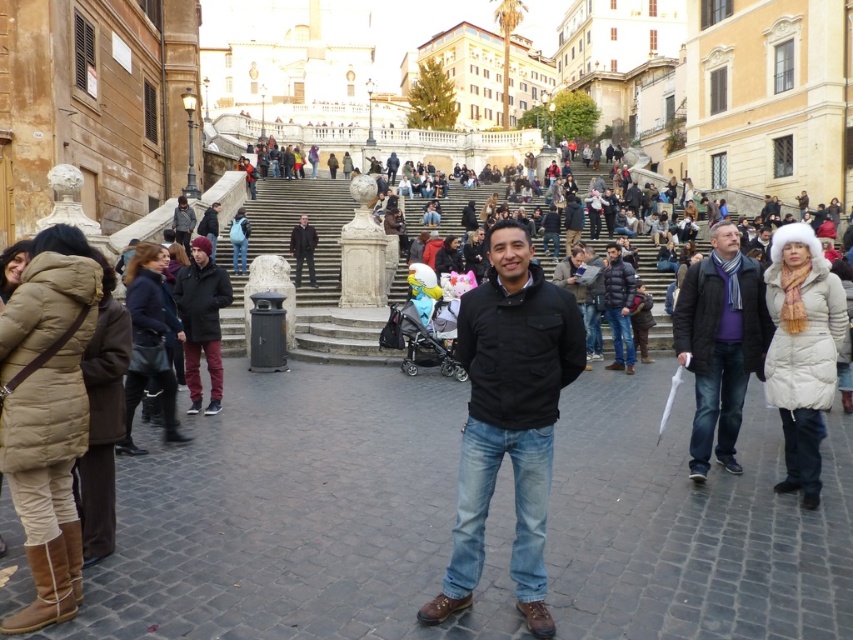
Does blue wool scarf at right have a smaller size compared to black leather jacket at upper center?

No, blue wool scarf at right is not smaller than black leather jacket at upper center.

This screenshot has height=640, width=853. Describe the element at coordinates (720, 342) in the screenshot. I see `blue wool scarf at right` at that location.

Which is behind, point (735, 273) or point (306, 230)?

Point (306, 230)

Find the location of a particular element. This screenshot has height=640, width=853. blue wool scarf at right is located at coordinates (720, 342).

Looking at this image, between black matte jacket at center and dark blue puffer jacket at center, which one is positioned lower?

Positioned lower is black matte jacket at center.

Is black matte jacket at center above dark blue puffer jacket at center?

No, black matte jacket at center is not above dark blue puffer jacket at center.

Does point (485, 444) come in front of point (611, 307)?

Yes.

This screenshot has width=853, height=640. What are the coordinates of `black matte jacket at center` in the screenshot? It's located at (509, 419).

Is the position of dark blue puffer jacket at center more distant than that of black leather jacket at upper center?

No, dark blue puffer jacket at center is closer to the viewer.

Between point (627, 300) and point (300, 266), which one is positioned in front?

Point (627, 300)

Find the location of a particular element. dark blue puffer jacket at center is located at coordinates (619, 307).